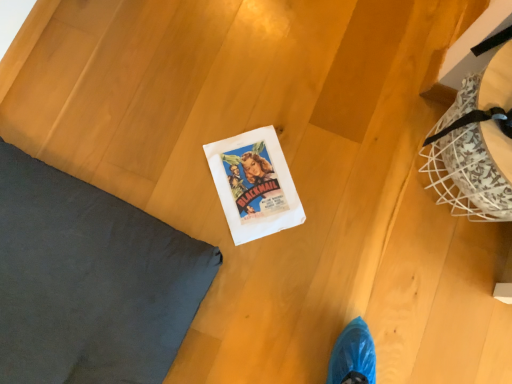
This screenshot has height=384, width=512. In order to click on vacant area to the left of white paper comic book at center in this screenshot , I will do `click(161, 128)`.